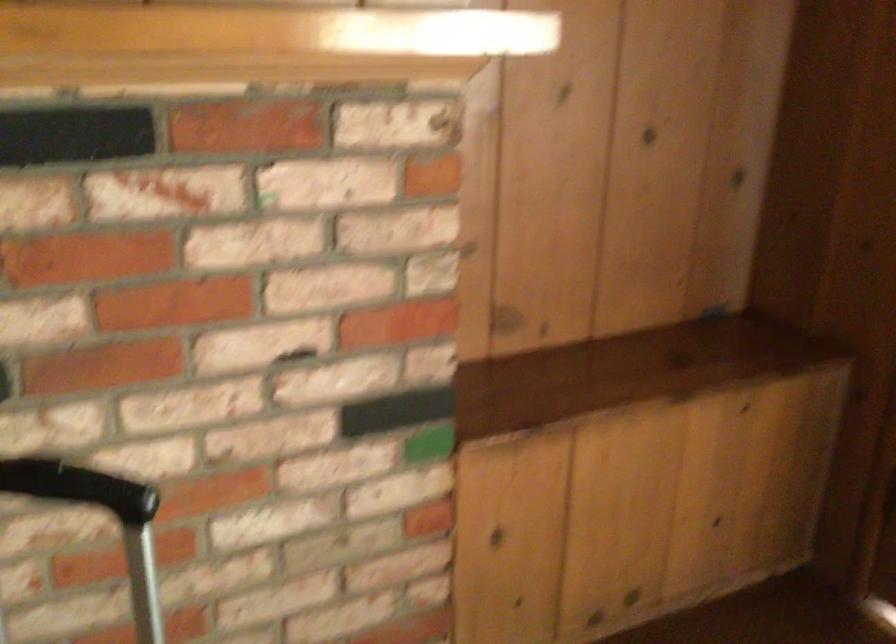
Locate an element on the screen. The image size is (896, 644). bench sitting surface is located at coordinates tap(625, 371).